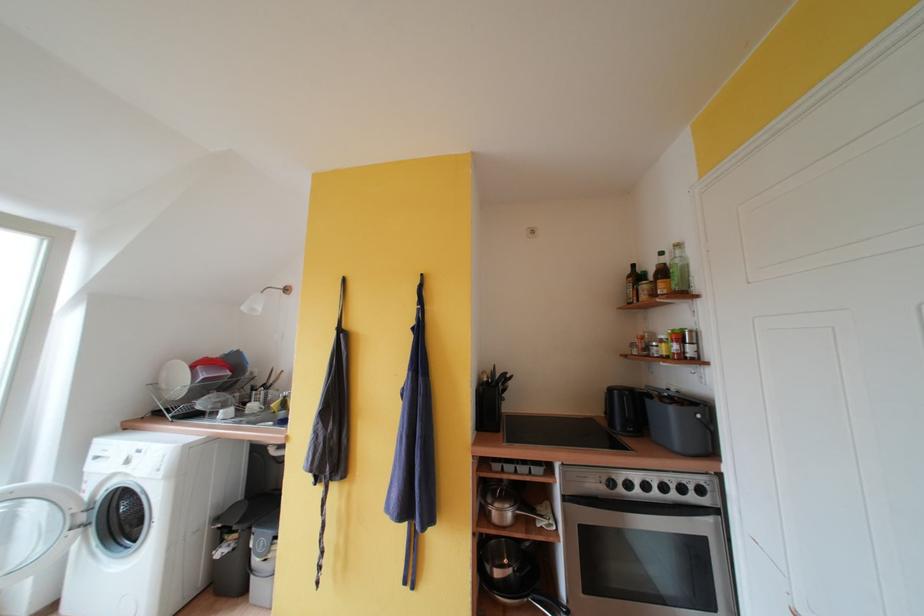
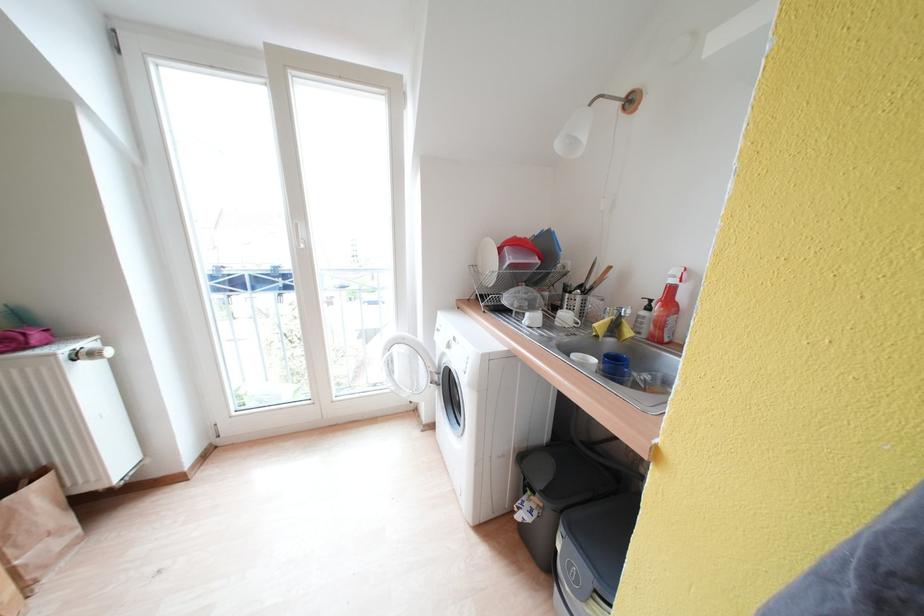
Locate, in the second image, the point that corresponds to (x=188, y=386) in the first image.

(497, 270)